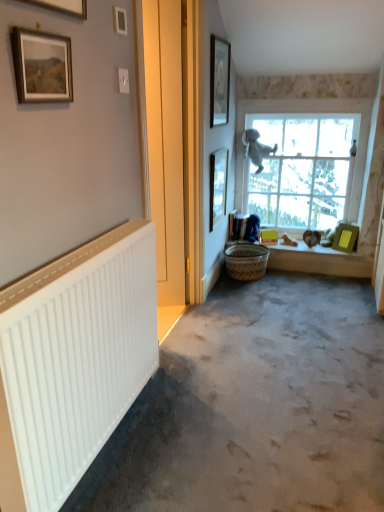
Question: Is white plastic radiator at left taller than clear glass window at upper right?

Choices:
 (A) yes
 (B) no

Answer: (B)

Question: Is white plastic radiator at left beside clear glass window at upper right?

Choices:
 (A) yes
 (B) no

Answer: (B)

Question: Could you tell me if white plastic radiator at left is facing clear glass window at upper right?

Choices:
 (A) yes
 (B) no

Answer: (B)

Question: From a real-world perspective, is white plastic radiator at left positioned over clear glass window at upper right based on gravity?

Choices:
 (A) no
 (B) yes

Answer: (A)

Question: Is white plastic radiator at left turned away from clear glass window at upper right?

Choices:
 (A) no
 (B) yes

Answer: (A)

Question: Can you confirm if white plastic radiator at left is wider than clear glass window at upper right?

Choices:
 (A) yes
 (B) no

Answer: (B)

Question: Is green matte picture frame at right, which ranks as the first picture frame in right-to-left order, bigger than clear glass window at upper right?

Choices:
 (A) yes
 (B) no

Answer: (B)

Question: Is the depth of green matte picture frame at right, which ranks as the first picture frame in right-to-left order, less than that of clear glass window at upper right?

Choices:
 (A) no
 (B) yes

Answer: (A)

Question: Is there a large distance between green matte picture frame at right, marked as the sixth picture frame in a left-to-right arrangement, and clear glass window at upper right?

Choices:
 (A) yes
 (B) no

Answer: (B)

Question: Considering the relative sizes of green matte picture frame at right, marked as the sixth picture frame in a left-to-right arrangement, and clear glass window at upper right in the image provided, is green matte picture frame at right, marked as the sixth picture frame in a left-to-right arrangement, taller than clear glass window at upper right?

Choices:
 (A) no
 (B) yes

Answer: (A)

Question: Is green matte picture frame at right, positioned as the 1th picture frame in back-to-front order, not inside clear glass window at upper right?

Choices:
 (A) yes
 (B) no

Answer: (A)

Question: Is the depth of green matte picture frame at right, which is counted as the sixth picture frame, starting from the front, greater than that of clear glass window at upper right?

Choices:
 (A) yes
 (B) no

Answer: (A)

Question: Can we say matte gold picture frame at upper left, the 6th picture frame when ordered from right to left, lies outside matte black picture frame at right, the 5th picture frame positioned from the front?

Choices:
 (A) no
 (B) yes

Answer: (B)